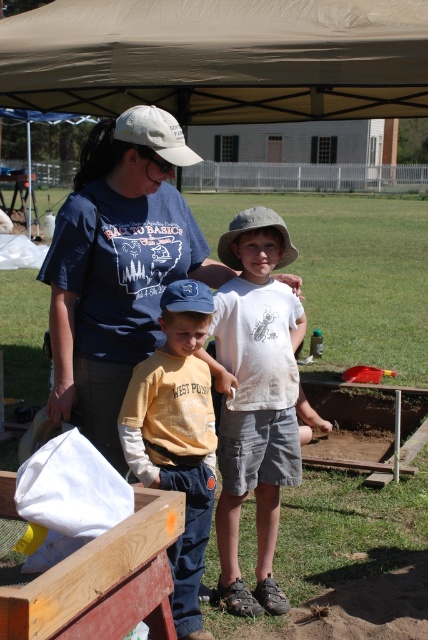
Question: Which point appears farthest from the camera in this image?

Choices:
 (A) (235, 525)
 (B) (380, 16)
 (C) (240, 264)
 (D) (172, 288)

Answer: (B)

Question: Considering the relative positions of yellow cotton shirt at center and white fabric baseball cap at upper left in the image provided, where is yellow cotton shirt at center located with respect to white fabric baseball cap at upper left?

Choices:
 (A) below
 (B) above

Answer: (A)

Question: Which object is the farthest from the white cotton shirt at center?

Choices:
 (A) blue fabric baseball cap at center
 (B) tan fabric canopy at upper center

Answer: (B)

Question: Which object appears farthest from the camera in this image?

Choices:
 (A) yellow cotton shirt at center
 (B) white fabric baseball cap at upper left

Answer: (A)

Question: Is blue cotton t-shirt at center positioned at the back of white cotton shirt at center?

Choices:
 (A) yes
 (B) no

Answer: (B)

Question: Is blue cotton t-shirt at center bigger than blue fabric baseball cap at center?

Choices:
 (A) yes
 (B) no

Answer: (A)